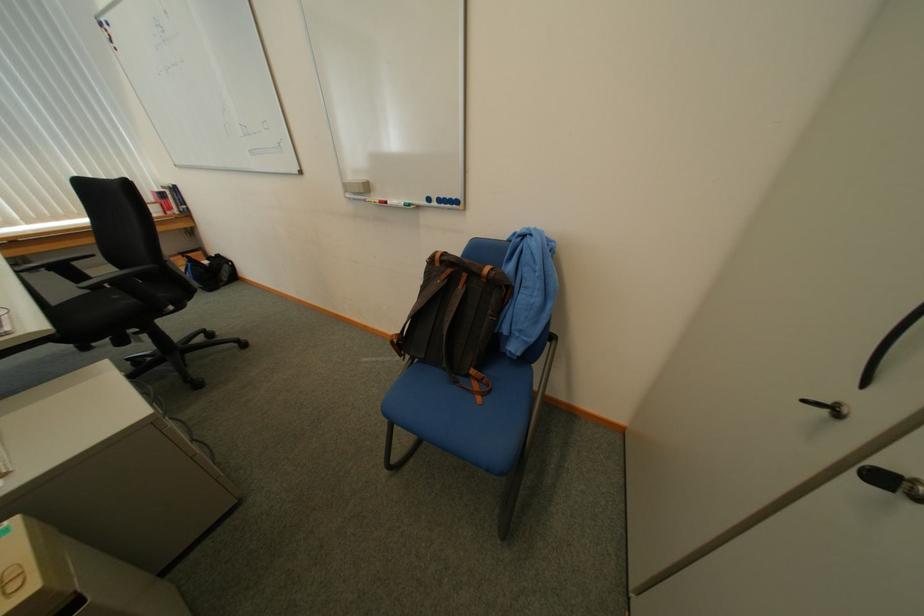
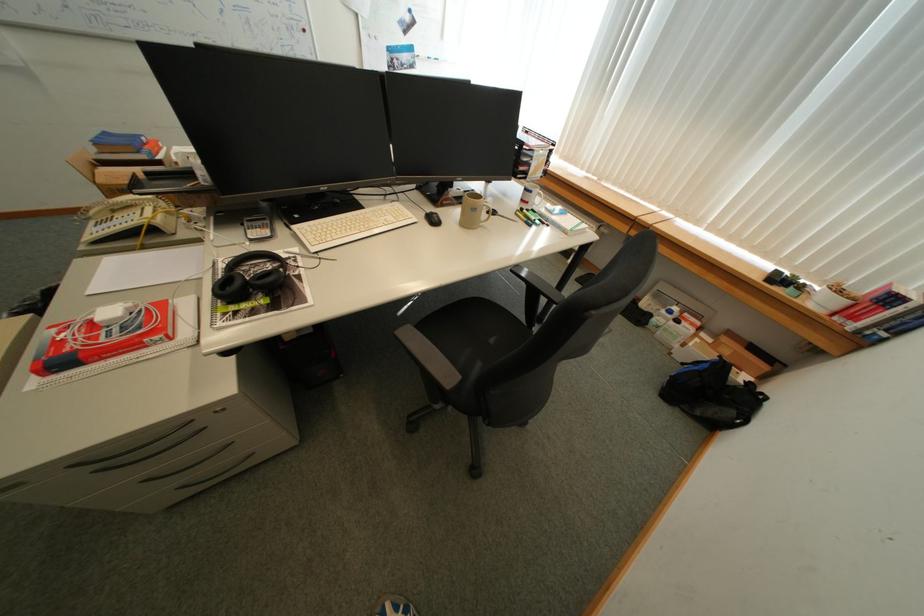
Find the pixel in the second image that matches the point at 235,281 in the first image.

(708, 415)